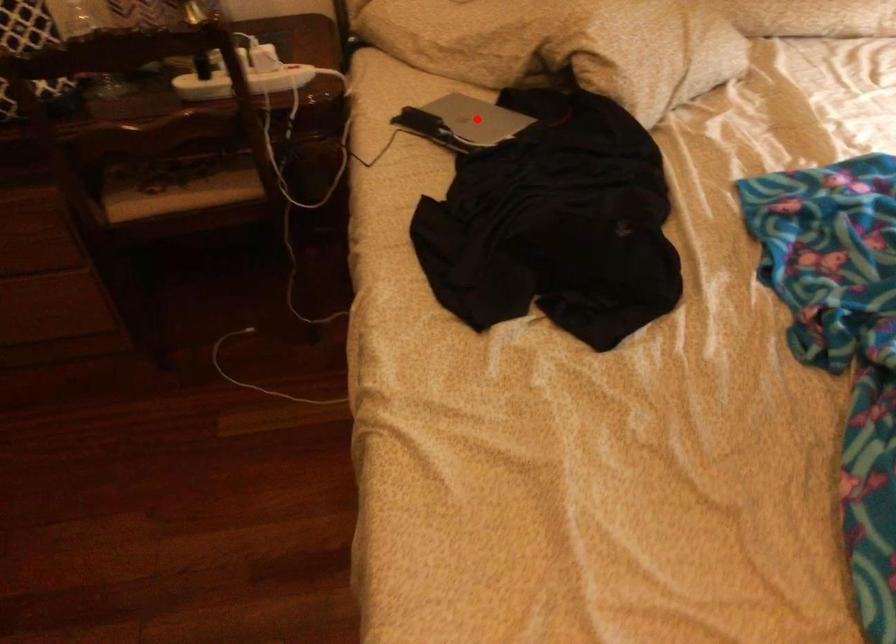
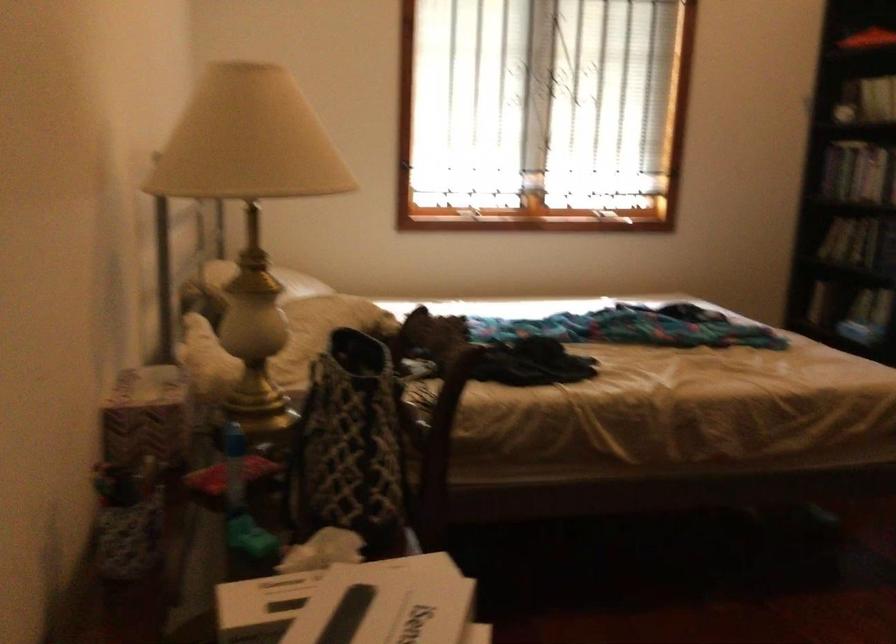
Question: I am providing you with two images of the same scene from different viewpoints. A red point is marked on the first image. Is the red point's position out of view in image 2?

Choices:
 (A) Yes
 (B) No

Answer: (A)